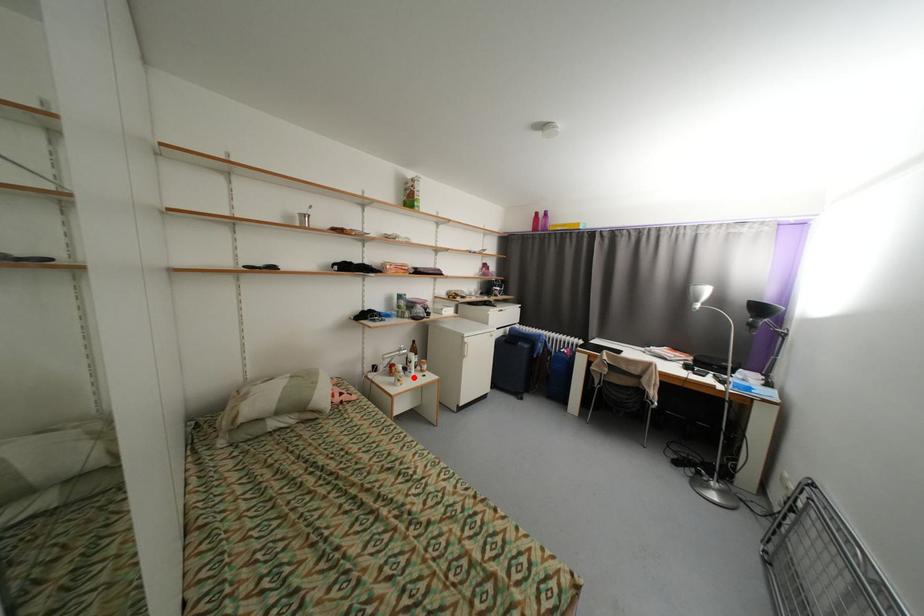
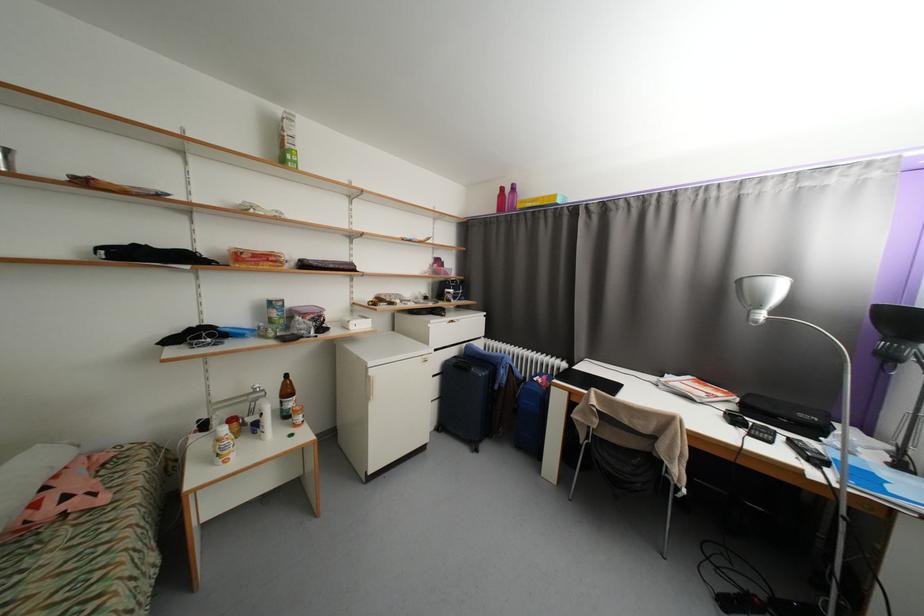
Where in the second image is the point corresponding to the highlighted location from the first image?

(265, 439)